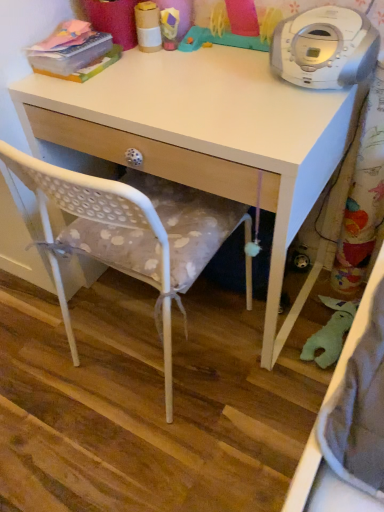
At what (x,y) coordinates should I click in order to perform the action: click on blank space situated above white matte desk at center (from a real-world perspective). Please return your answer as a coordinate pair (x, y). Looking at the image, I should click on (190, 80).